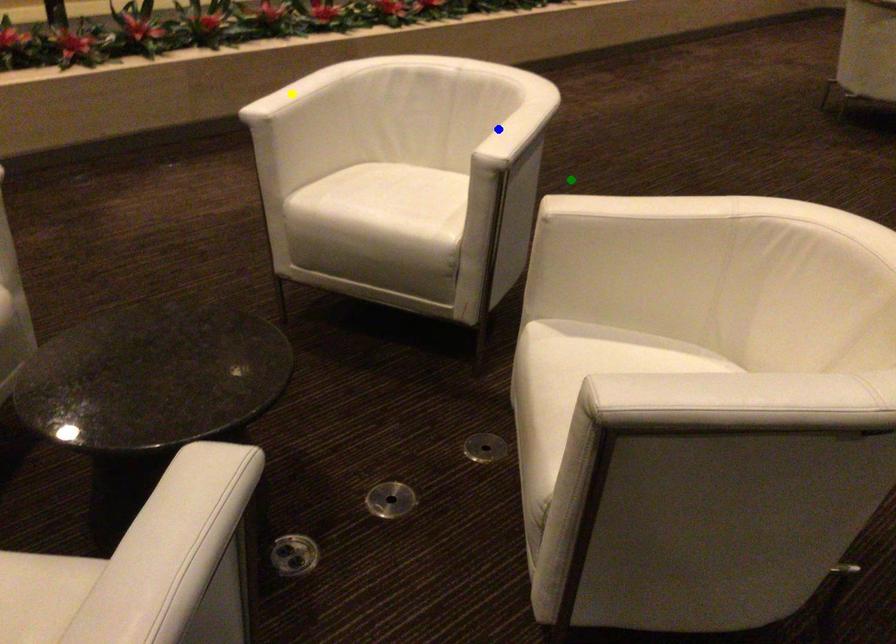
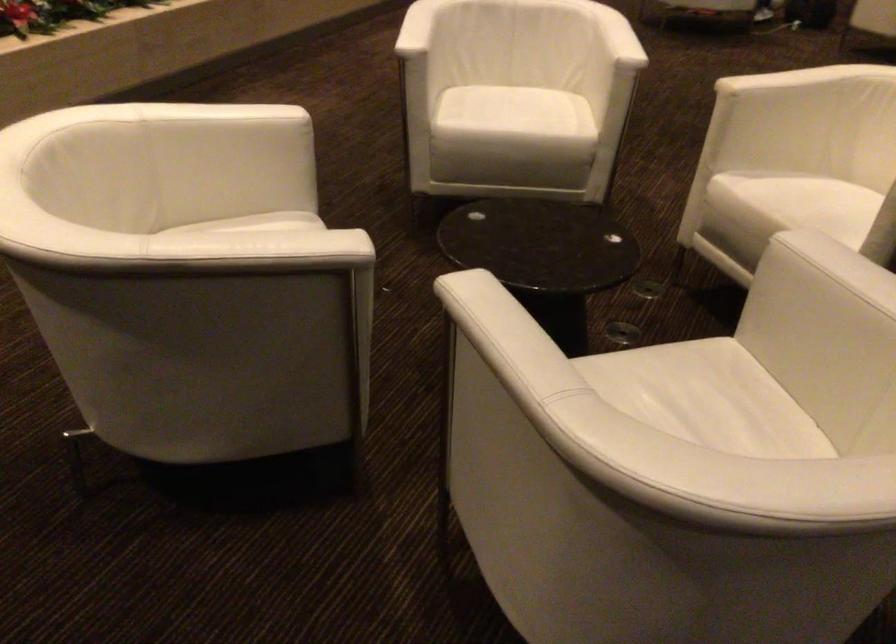
I am providing you with two images of the same scene from different viewpoints. Three points are marked in image1. Which point corresponds to a part or object that is occluded in image2?In image1, three points are marked. Which of them correspond to a part or object that is occluded in image2?Among the three points shown in image1, which one corresponds to a part or object that is no longer visible due to occlusion in image2?

green point